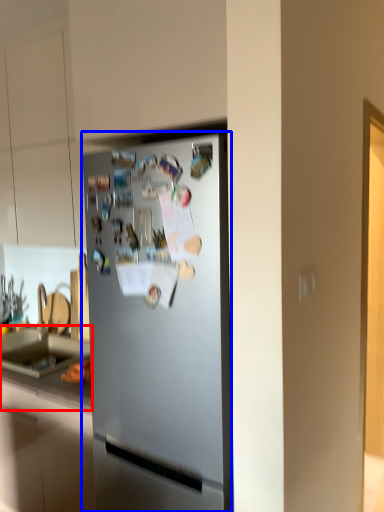
Question: Which object appears farthest to the camera in this image, counter top (highlighted by a red box) or refrigerator (highlighted by a blue box)?

Choices:
 (A) counter top
 (B) refrigerator

Answer: (A)